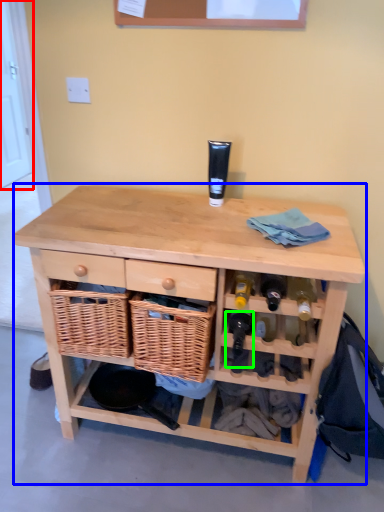
Question: Based on their relative distances, which object is farther from door (highlighted by a red box)? Choose from table (highlighted by a blue box) and wine bottle (highlighted by a green box).

Choices:
 (A) table
 (B) wine bottle

Answer: (B)